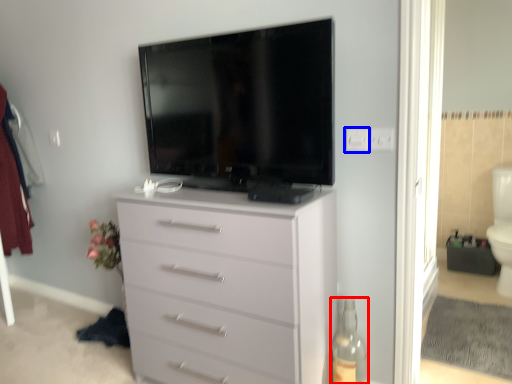
Question: Which object is further to the camera taking this photo, bottle (highlighted by a red box) or electric outlet (highlighted by a blue box)?

Choices:
 (A) bottle
 (B) electric outlet

Answer: (B)